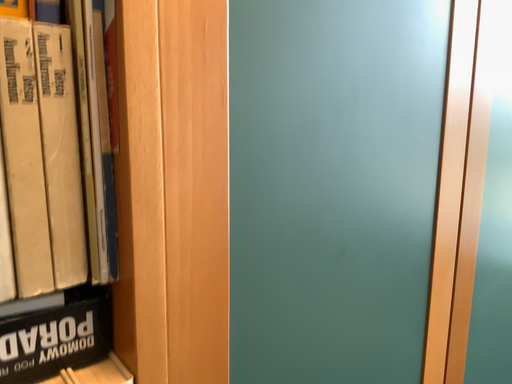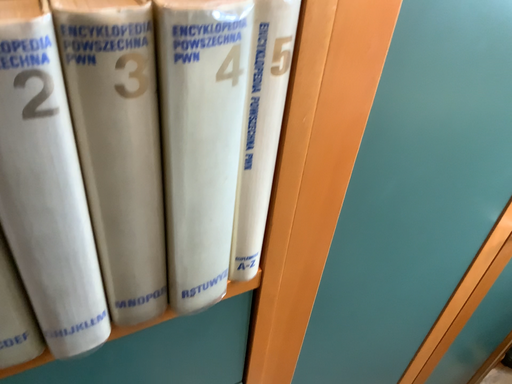
Question: How did the camera likely rotate when shooting the video?

Choices:
 (A) rotated upward
 (B) rotated downward

Answer: (B)